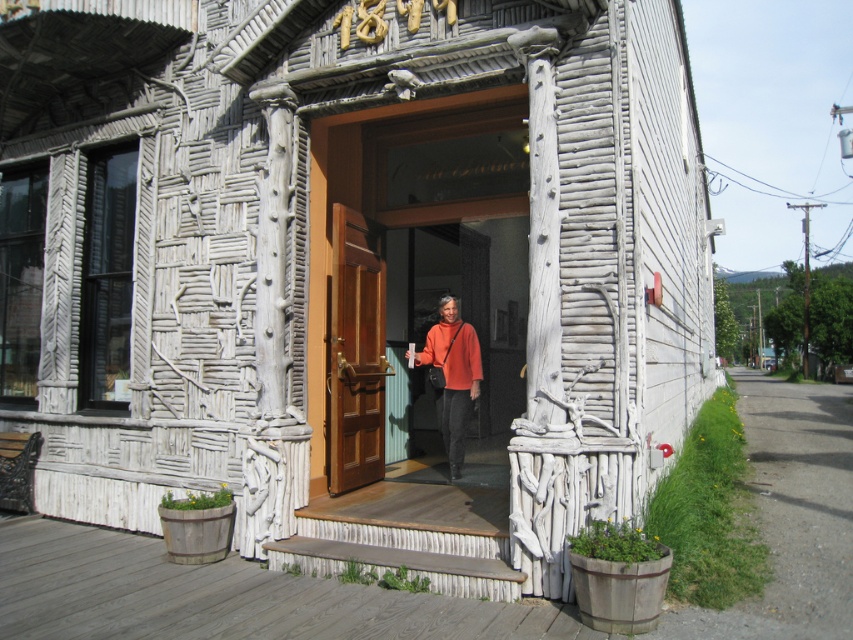
You are an architect designing a new entrance for a nature center. You need to ensure that the entrance door can accommodate a standard wheelchair ramp. Given the current brown wooden door at center and the orange sweater at center, which object is wider and might affect the ramp placement?

The orange sweater at center is wider than the brown wooden door at center, so the ramp placement should consider the orange sweater at center as it is wider.

You are a visitor approaching the entrance of this building. You need to place a small package on the doorstep. The package is 12 inches long. Can you determine if the distance between the brown wooden door at center and the orange sweater at center is sufficient to place the package there?

The brown wooden door at center is 35.03 inches from the orange sweater at center. Since the package is 12 inches long, the distance between them is sufficient to place the package there as 35.03 inches is greater than 12 inches.

You are standing outside the building and want to enter. The brown wooden door at center is the entrance. Is the orange sweater at center blocking your path to the door?

The brown wooden door at center is in front of orange sweater at center, so the orange sweater at center is behind the door and not blocking the path to the entrance.